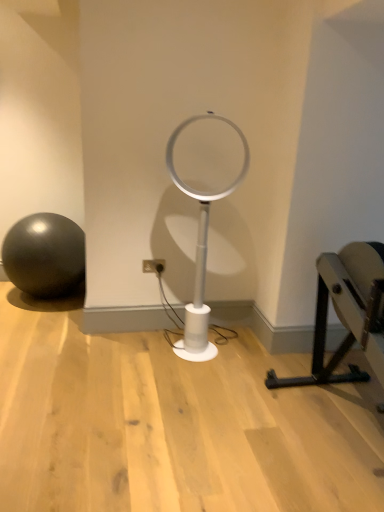
Question: In terms of height, does black metal bench at right look taller or shorter compared to matte black ball at left?

Choices:
 (A) tall
 (B) short

Answer: (A)

Question: Considering the relative positions of black metal bench at right and matte black ball at left in the image provided, is black metal bench at right to the left or to the right of matte black ball at left?

Choices:
 (A) right
 (B) left

Answer: (A)

Question: Which object is the farthest from the white plastic table lamp at center?

Choices:
 (A) black metal bench at right
 (B) white plastic electric outlet at center
 (C) matte black ball at left

Answer: (C)

Question: Estimate the real-world distances between objects in this image. Which object is farther from the white plastic table lamp at center?

Choices:
 (A) white plastic electric outlet at center
 (B) matte black ball at left
 (C) black metal bench at right

Answer: (B)